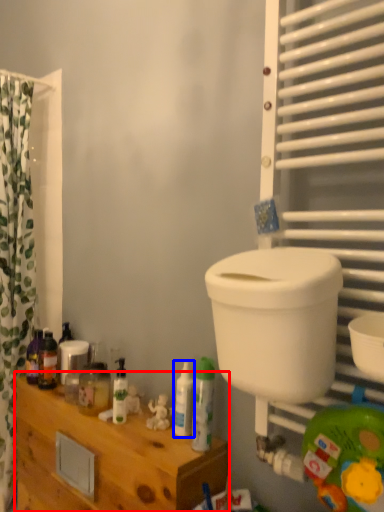
Question: Which point is further to the camera, furniture (highlighted by a red box) or toiletry (highlighted by a blue box)?

Choices:
 (A) furniture
 (B) toiletry

Answer: (B)